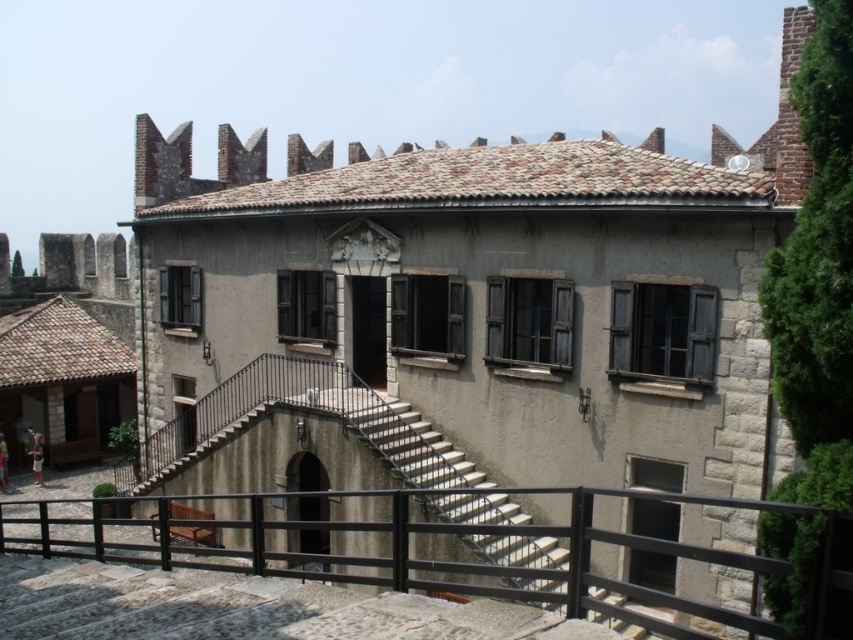
You are standing at the entrance of the historic stone building and want to know the exact location of the black metal railing at lower center. Can you tell me its coordinates?

The black metal railing at lower center is located at coordinates point (427, 552).

You are a delivery person trying to deliver a package to the entrance of the historic stone building. You need to know if you can safely walk between the black metal railing at lower center and the white concrete stairs at center with a 10 feet wide delivery truck. Is there enough space?

The distance between the black metal railing at lower center and the white concrete stairs at center is 12.20 feet. Since the delivery truck is 10 feet wide, there is sufficient space for the truck to pass through safely.

You are standing at the base of the stairs in front of the historic stone building. You want to climb up to the entrance. Which object should you step over first, the black metal railing at lower center or the white concrete stairs at center?

You should step over the black metal railing at lower center first because it is below the white concrete stairs at center.